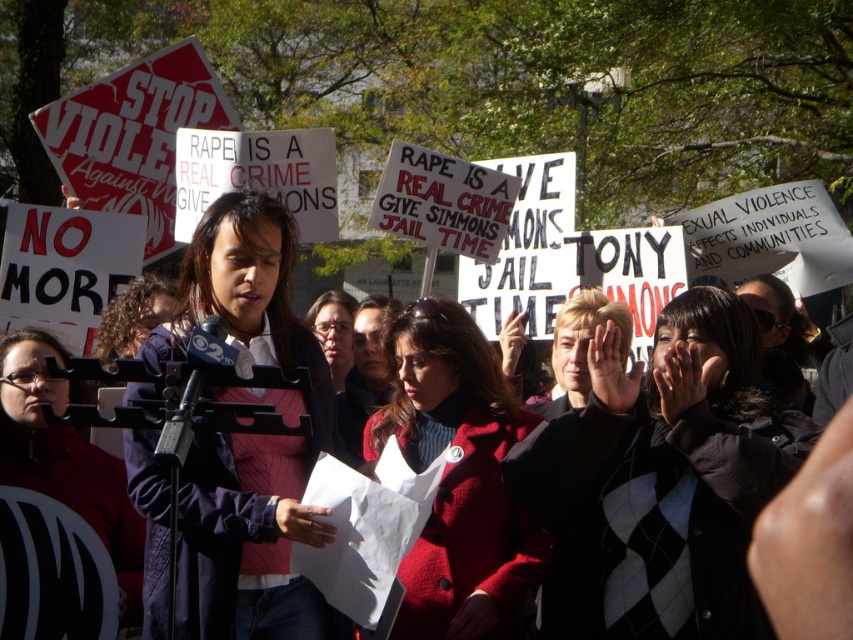
You are a photographer standing at the camera position. You need to capture a closeup shot of the woman holding papers in her hands. However, you are only allowed to move forward or backward along the path. Given that the distance between point (154, 538) and the camera is 62.72 feet, what is the minimum distance you need to move to get closer to the woman?

The minimum distance you need to move is 62.72 feet forward to reach the point (154, 538), which is closest to the woman holding papers in her hands.

Based on the scene, which object at the center is smaller in size between the red wool coat at center and the matte black microphone at center?

The red wool coat at center has a smaller size compared to the matte black microphone at center, so the red wool coat at center is smaller.

You are a photographer trying to capture a clear shot of the matte black microphone at center without the dark blue jacket at center blocking it. Based on their sizes, is this possible?

The dark blue jacket at center is larger in size than the matte black microphone at center, so it might block the microphone. Adjust your angle to ensure the smaller microphone is visible beyond the jacket.